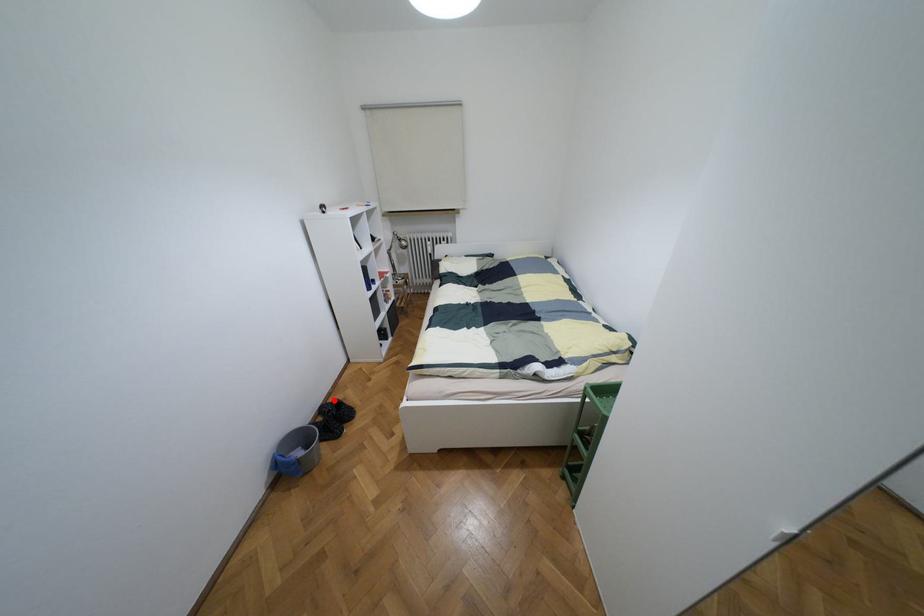
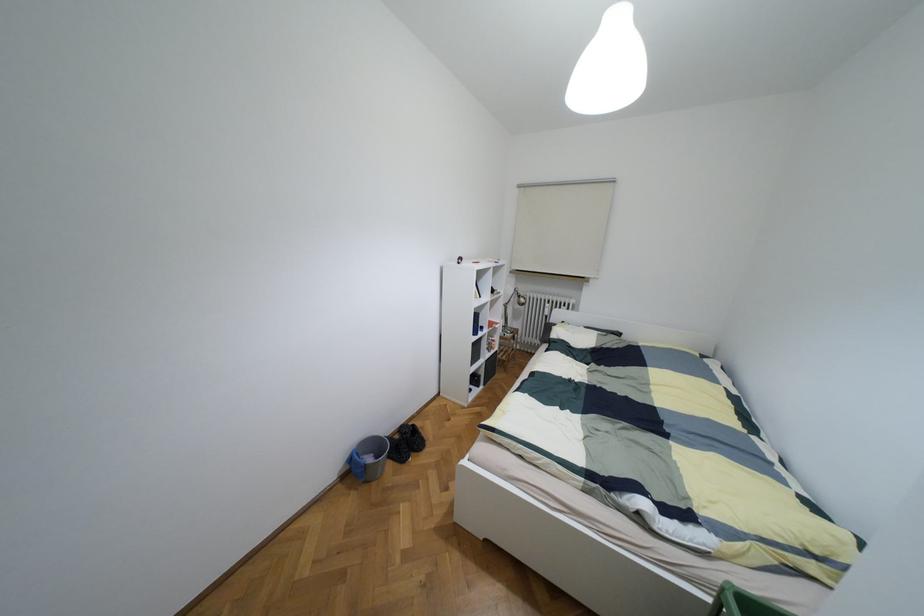
Question: I am providing you with two images of the same scene from different viewpoints. In image1, a red point is highlighted. Considering the same 3D point in image2, which of the following is correct?

Choices:
 (A) It is closer
 (B) It is farther

Answer: (A)